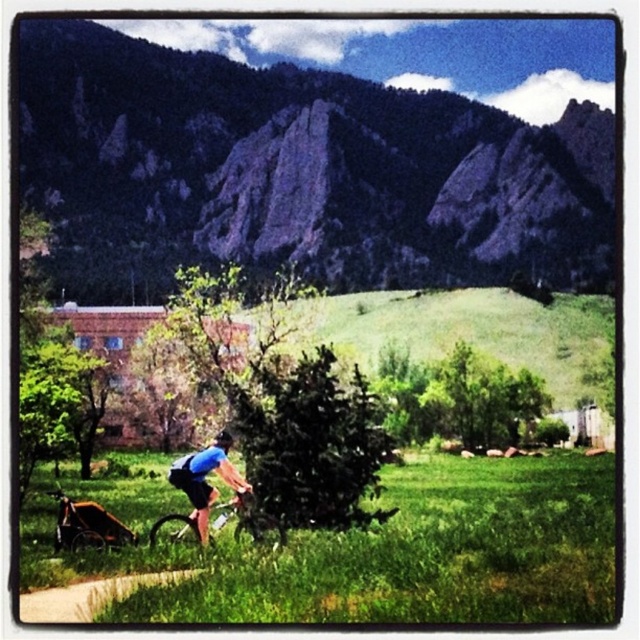
Question: Is green rock formation at center closer to camera compared to black matte bicycle helmet at center?

Choices:
 (A) no
 (B) yes

Answer: (A)

Question: Which of the following is the farthest from the observer?

Choices:
 (A) orange matte stroller at lower left
 (B) matte black mountain bike at center
 (C) black matte bicycle helmet at center
 (D) green rock formation at center

Answer: (D)

Question: Which point is farther to the camera?

Choices:
 (A) (227, 445)
 (B) (467, 262)

Answer: (B)

Question: Can you confirm if matte black mountain bike at center is thinner than black matte bicycle helmet at center?

Choices:
 (A) no
 (B) yes

Answer: (A)

Question: In this image, where is green rock formation at center located relative to orange matte stroller at lower left?

Choices:
 (A) left
 (B) right

Answer: (B)

Question: Which object is positioned farthest from the green rock formation at center?

Choices:
 (A) black matte bicycle helmet at center
 (B) orange matte stroller at lower left

Answer: (B)